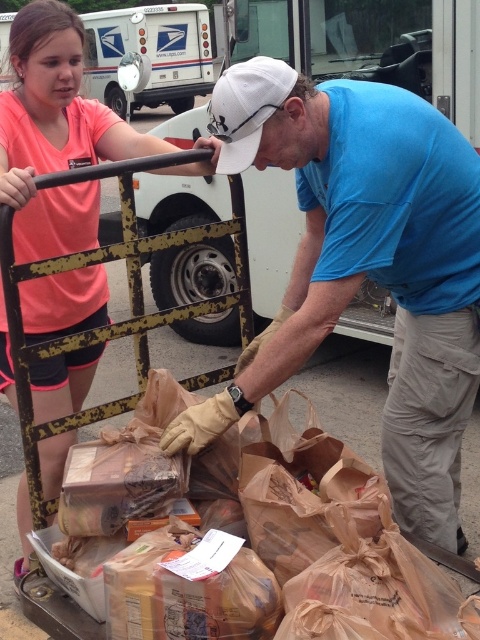
You are standing at the origin point of the coordinate system. There is a blue t shirt at center represented by point (364, 266). Can you tell me the coordinates of the blue t shirt at center?

The coordinates of the blue t shirt at center are (364, 266).